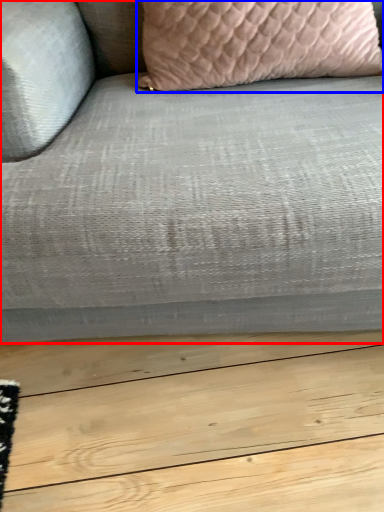
Question: Among these objects, which one is nearest to the camera, studio couch (highlighted by a red box) or pillow (highlighted by a blue box)?

Choices:
 (A) studio couch
 (B) pillow

Answer: (A)